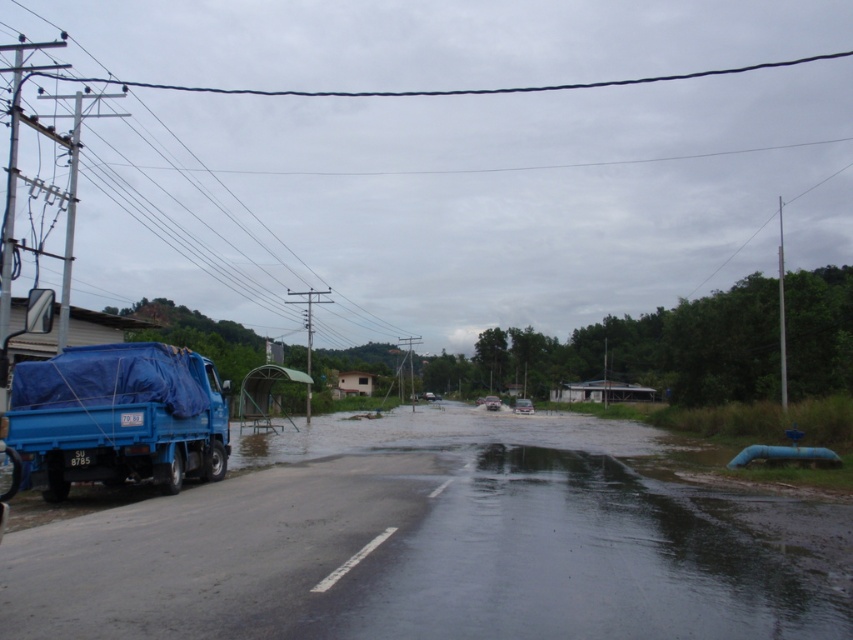
You are a delivery driver who needs to park your truck in a flooded area. You see the blue tarpaulin flood at left and the blue tarpaulin truck at left. Which object should you avoid parking near to prevent getting your truck submerged?

You should avoid parking near the blue tarpaulin flood at left because it is positioned under the blue tarpaulin truck at left, indicating the flood is located beneath the truck and could submerge it if parked there.

You are a delivery driver who needs to pass through the flooded area in the image. Your vehicle has a clearance of 3 feet. The blue tarpaulin flood at left has a depth of 2.5 feet. Can your vehicle safely pass through the flooded area near the blue tarpaulin truck at left without getting stuck?

The blue tarpaulin flood at left has a depth of 2.5 feet. Since your vehicle has a clearance of 3 feet, which is higher than the flood depth, your vehicle can safely pass through the flooded area near the blue tarpaulin truck at left.

You are a delivery driver who needs to drive through the flooded area. The black wire at upper center and the blue tarpaulin flood at left are in your path. Which obstacle is closer to you as you approach the flooded area?

The black wire at upper center is closer to you because it is further to the viewer than the blue tarpaulin flood at left, meaning it is nearer in your line of sight as you approach.